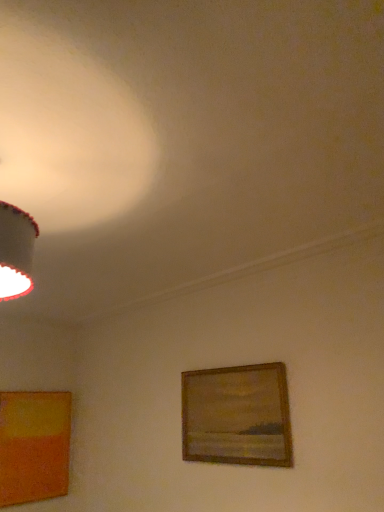
Question: Does matte orange picture frame at lower left, which is the 1th picture frame in back-to-front order, have a greater width compared to wooden picture frame at center, which ranks as the 1th picture frame in right-to-left order?

Choices:
 (A) yes
 (B) no

Answer: (A)

Question: Is matte orange picture frame at lower left, which is the 1th picture frame in back-to-front order, turned away from wooden picture frame at center, the first picture frame when ordered from front to back?

Choices:
 (A) yes
 (B) no

Answer: (B)

Question: Is matte orange picture frame at lower left, which is the 1th picture frame in back-to-front order, closer to the viewer compared to wooden picture frame at center, which ranks as the 1th picture frame in right-to-left order?

Choices:
 (A) yes
 (B) no

Answer: (B)

Question: Can you confirm if matte orange picture frame at lower left, which appears as the 2th picture frame when viewed from the front, is positioned to the right of wooden picture frame at center, which is the second picture frame from back to front?

Choices:
 (A) no
 (B) yes

Answer: (A)

Question: Is matte orange picture frame at lower left, the second picture frame in the right-to-left sequence, positioned behind wooden picture frame at center, which ranks as the 1th picture frame in right-to-left order?

Choices:
 (A) yes
 (B) no

Answer: (A)

Question: From a real-world perspective, is matte orange picture frame at lower left, the second picture frame in the right-to-left sequence, physically above wooden picture frame at center, the first picture frame when ordered from front to back?

Choices:
 (A) no
 (B) yes

Answer: (A)

Question: Does wooden picture frame at center, which ranks as the 1th picture frame in right-to-left order, appear on the right side of matte orange picture frame at lower left, which appears as the 2th picture frame when viewed from the front?

Choices:
 (A) yes
 (B) no

Answer: (A)

Question: From a real-world perspective, is wooden picture frame at center, which appears as the second picture frame when viewed from the left, on top of matte orange picture frame at lower left, which appears as the 2th picture frame when viewed from the front?

Choices:
 (A) no
 (B) yes

Answer: (B)

Question: From a real-world perspective, is wooden picture frame at center, which is the second picture frame from back to front, positioned under matte orange picture frame at lower left, which appears as the 2th picture frame when viewed from the front, based on gravity?

Choices:
 (A) no
 (B) yes

Answer: (A)

Question: Is wooden picture frame at center, the first picture frame when ordered from front to back, located outside matte orange picture frame at lower left, which appears as the 2th picture frame when viewed from the front?

Choices:
 (A) yes
 (B) no

Answer: (A)

Question: Considering the relative sizes of wooden picture frame at center, which is the second picture frame from back to front, and matte orange picture frame at lower left, which is the 1th picture frame in back-to-front order, in the image provided, is wooden picture frame at center, which is the second picture frame from back to front, thinner than matte orange picture frame at lower left, which is the 1th picture frame in back-to-front order,?

Choices:
 (A) no
 (B) yes

Answer: (B)

Question: Does wooden picture frame at center, which is the second picture frame from back to front, come behind matte orange picture frame at lower left, which is the 1th picture frame from left to right?

Choices:
 (A) yes
 (B) no

Answer: (B)

Question: From a real-world perspective, is wooden picture frame at center, which appears as the second picture frame when viewed from the left, above or below matte orange picture frame at lower left, which appears as the 2th picture frame when viewed from the front?

Choices:
 (A) below
 (B) above

Answer: (B)